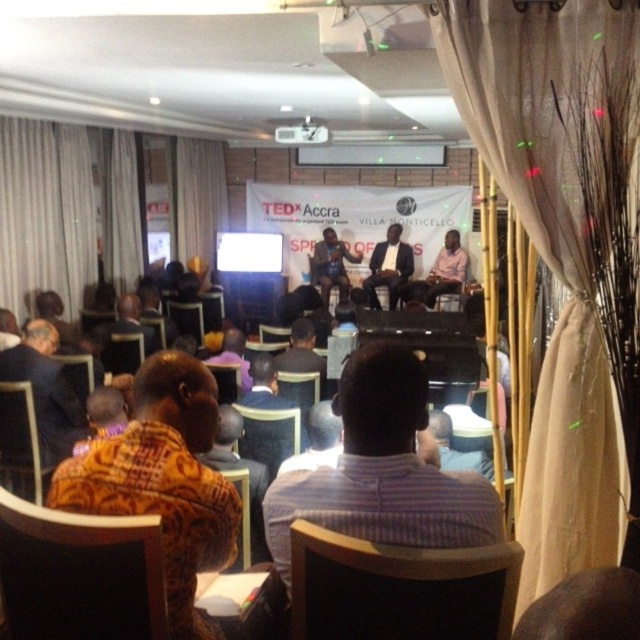
Question: Can you confirm if white sheer curtain at upper center is positioned above wooden at left?

Choices:
 (A) yes
 (B) no

Answer: (A)

Question: Which object is the closest to the matte black shirt at center?

Choices:
 (A) matte black laptop at center
 (B) printed fabric shirt at center
 (C) striped shirt at center

Answer: (A)

Question: Which point is farther to the camera?

Choices:
 (A) (268, 461)
 (B) (70, 518)
 (C) (67, 388)

Answer: (C)

Question: Which point is farther to the camera?

Choices:
 (A) (438, 289)
 (B) (480, 499)

Answer: (A)

Question: Can you confirm if wooden chair at lower left is positioned below matte black shirt at center?

Choices:
 (A) no
 (B) yes

Answer: (B)

Question: In this image, where is striped shirt at center located relative to satin black suit at center?

Choices:
 (A) above
 (B) below

Answer: (B)